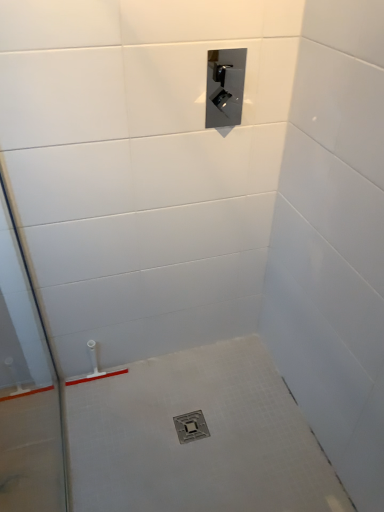
Question: From a real-world perspective, is satin nickel control panel at upper center physically located above or below transparent glass door at left?

Choices:
 (A) above
 (B) below

Answer: (A)

Question: From the image's perspective, is satin nickel control panel at upper center located above or below transparent glass door at left?

Choices:
 (A) below
 (B) above

Answer: (B)

Question: Which object is positioned farthest from the satin nickel control panel at upper center?

Choices:
 (A) transparent glass door at left
 (B) metallic silver drain at center

Answer: (B)

Question: Which object is positioned farthest from the metallic silver drain at center?

Choices:
 (A) transparent glass door at left
 (B) satin nickel control panel at upper center

Answer: (B)